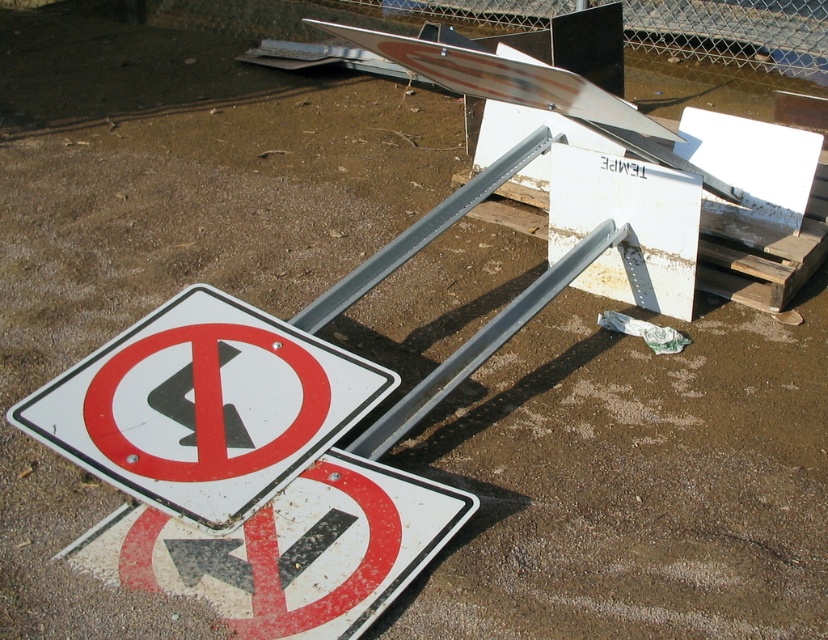
Question: Which point appears farthest from the camera in this image?

Choices:
 (A) (179, 324)
 (B) (131, 547)

Answer: (A)

Question: In this image, where is white matte traffic sign at lower left located relative to white plastic traffic sign at lower left?

Choices:
 (A) left
 (B) right

Answer: (A)

Question: Does white matte traffic sign at lower left have a greater width compared to white plastic traffic sign at lower left?

Choices:
 (A) no
 (B) yes

Answer: (B)

Question: Which point is farther to the camera?

Choices:
 (A) white matte traffic sign at lower left
 (B) white plastic traffic sign at lower left

Answer: (A)

Question: Does white matte traffic sign at lower left have a smaller size compared to white plastic traffic sign at lower left?

Choices:
 (A) no
 (B) yes

Answer: (A)

Question: Which of the following is the closest to the observer?

Choices:
 (A) (230, 397)
 (B) (230, 579)

Answer: (B)